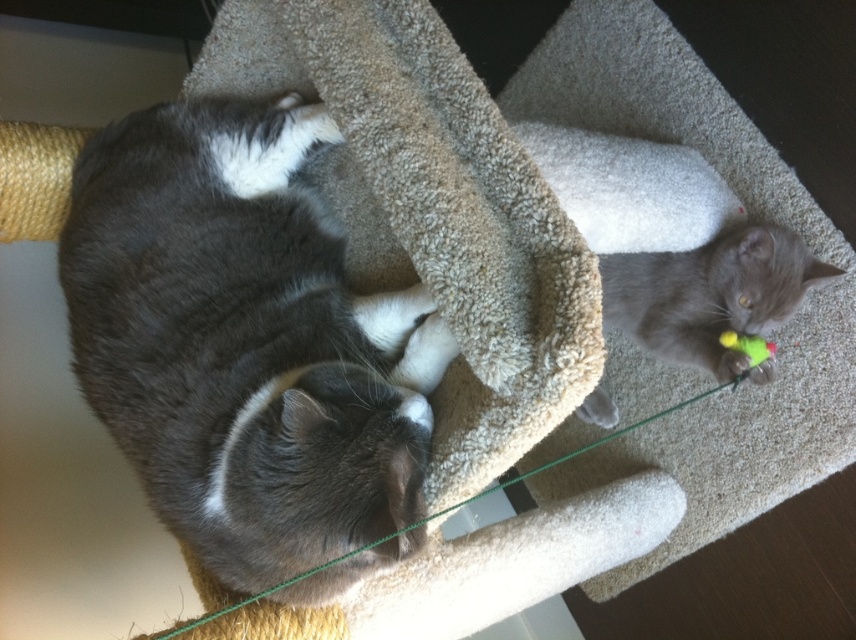
You are a cat trying to reach the gray soft toy at right and the green string at center. Which object is closer to your current position if you are standing at the left side of the cat tree?

The green string at center is closer because it is positioned between you and the gray soft toy at right.

You are trying to place a new cat bed on the cat tree. The bed is designed to fit a cat the size of the gray fluffy cat at left. Will it also accommodate the gray soft toy at right?

The gray fluffy cat at left is larger in width than the gray soft toy at right, so the bed designed for the gray fluffy cat at left should also accommodate the gray soft toy at right.

You are a cat owner who wants to place a new toy for your cats. You have a gray soft toy at right and a green string at center. Which toy can you place closer to the edge of the cat tree platform without falling off?

The gray soft toy at right is thinner than the green string at center, so the gray soft toy at right can be placed closer to the edge of the cat tree platform without falling off because its smaller size provides better stability.